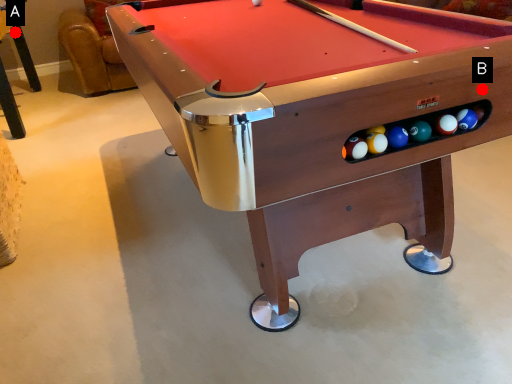
Question: Two points are circled on the image, labeled by A and B beside each circle. Which of the following is the closest to the observer?

Choices:
 (A) A is closer
 (B) B is closer

Answer: (B)